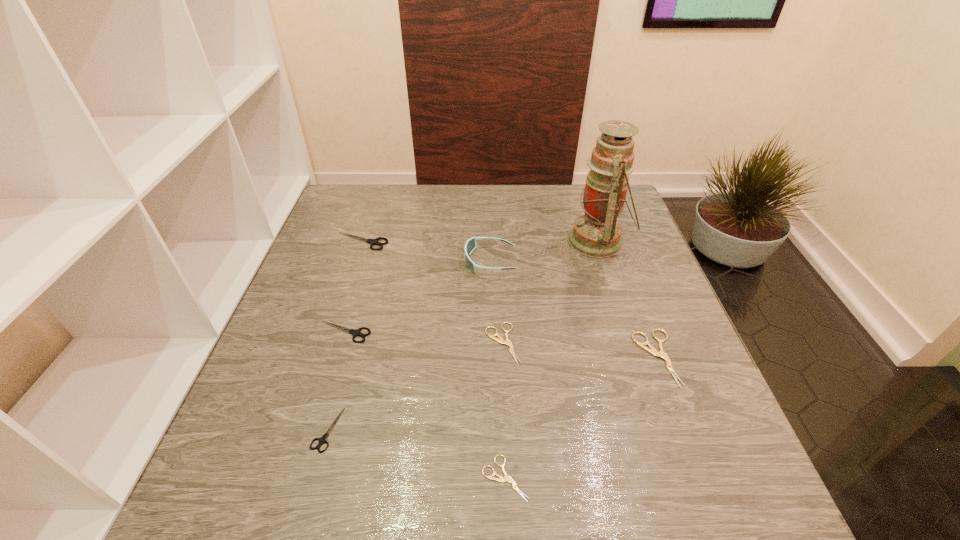
Where is `the nearest black shears`? Image resolution: width=960 pixels, height=540 pixels. the nearest black shears is located at coordinates (322, 440).

Image resolution: width=960 pixels, height=540 pixels. I want to click on the smallest beige shears, so click(x=507, y=478).

This screenshot has height=540, width=960. Identify the location of the nearest beige shears. (507, 478).

Identify the location of blank area located 0.340m on the left of the oil lamp. (445, 241).

I want to click on vacant region located 0.140m on the front-facing side of the seventh shortest object, so click(x=411, y=261).

You are a GUI agent. You are given a task and a screenshot of the screen. Output one action in this format:
    pyautogui.click(x=<x>, y=<y>)
    Task: Click on the free region located 0.210m on the front-facing side of the seventh shortest object
    The height and width of the screenshot is (540, 960).
    Given the screenshot: What is the action you would take?
    pyautogui.click(x=384, y=261)

At what (x,y) coordinates should I click in order to perform the action: click on free spot located on the front-facing side of the seventh shortest object. Please return your answer as a coordinate pair (x, y). The height and width of the screenshot is (540, 960). Looking at the image, I should click on (342, 261).

Identify the location of free space located on the right of the third tallest object. (497, 241).

Find the location of a particular element. Image resolution: width=960 pixels, height=540 pixels. free spot located on the front of the second smallest black shears is located at coordinates (324, 400).

Where is `vacant space located on the left of the biggest beige shears`? vacant space located on the left of the biggest beige shears is located at coordinates coord(557,357).